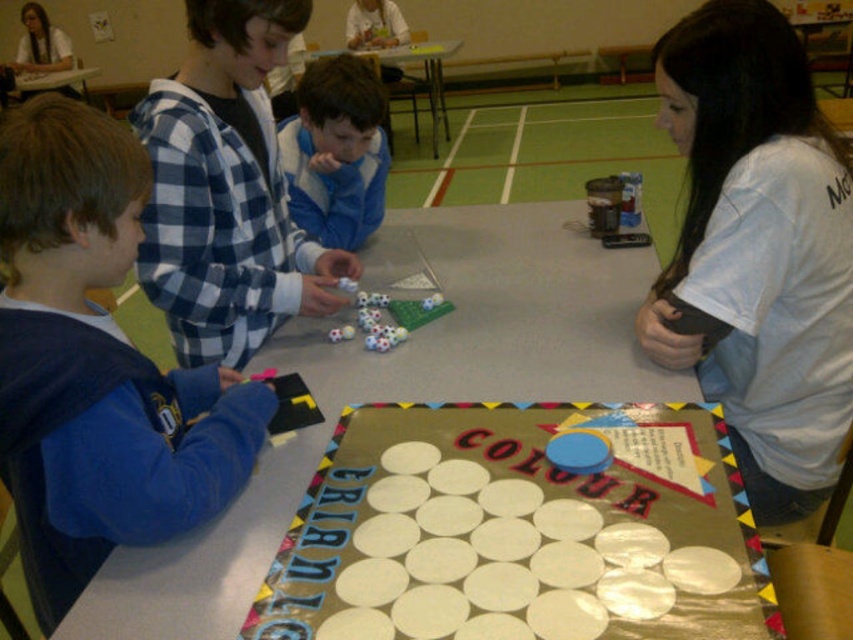
You are a photographer trying to capture the board game scene. You need to focus on the white cotton shirt at upper right and the smooth plastic table at center. Which object should you adjust your camera focus on first if you want to focus on the closer one?

The white cotton shirt at upper right is closer than the smooth plastic table at center, so you should focus on the white cotton shirt at upper right first.

You are a child participating in the board game and want to place a small token on the white plastic circles at center. If your hand is 1 meter away from the circles, can you reach them without moving closer?

The white plastic circles at center are 85.19 centimeters from the viewer, so yes, you can reach them since your hand is already 1 meter away, which is farther than the distance to the circles.

You are a teacher organizing a game for children. You have a white plastic circles at center and a smooth plastic table at center. Which object is wider?

The smooth plastic table at center is wider than the white plastic circles at center.